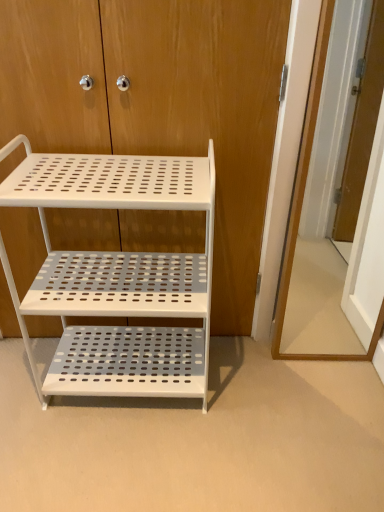
Identify the location of empty space that is to the right of white perforated metal shelf at center. The image size is (384, 512). (290, 397).